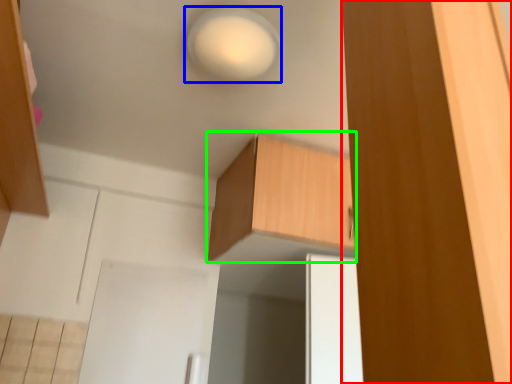
Question: Estimate the real-world distances between objects in this image. Which object is closer to cabinetry (highlighted by a red box), light (highlighted by a blue box) or cabinetry (highlighted by a green box)?

Choices:
 (A) light
 (B) cabinetry

Answer: (A)